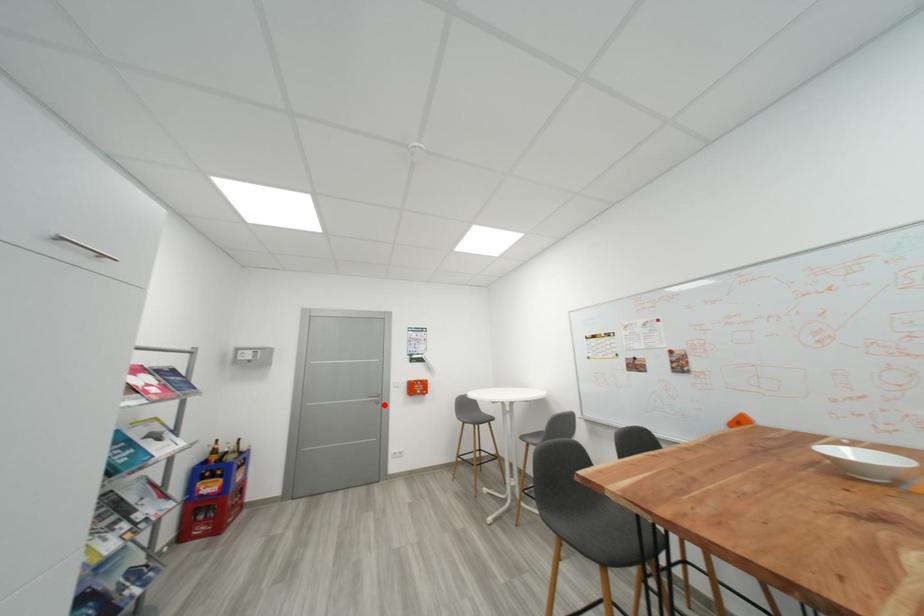
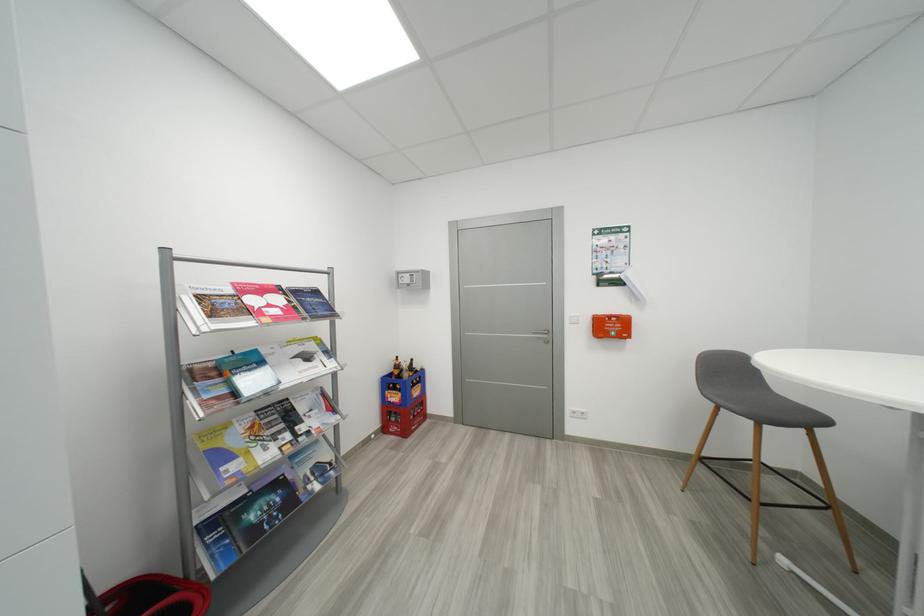
Question: A red point is marked in image1. In image2, is the corresponding 3D point closer to the camera or farther? Reply with the corresponding letter.

Choices:
 (A) The corresponding 3D point is closer.
 (B) The corresponding 3D point is farther.

Answer: (A)